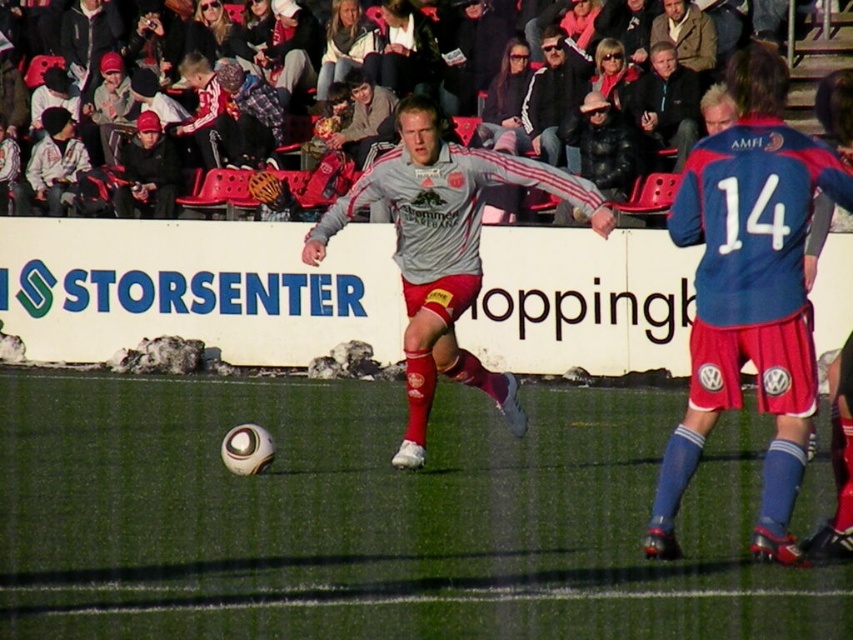
You are a soccer coach analyzing the play. The ball is at the center of the field. The matte gray jersey at center is 10.83 meters away from the blue jersey with red sleeves on the right. If the field is 100 meters long, what percentage of the field length does this distance represent?

The distance between the matte gray jersey at center and the blue jersey with red sleeves on the right is 10.83 meters. To find the percentage of the field length, divide 10.83 by 100 and multiply by 100, resulting in 10.83 percent. Thus, the distance represents approximately 10.83 percent of the field length.

You are a soccer coach analyzing the players on the field. You notice the blue jersey at right and the matte black jacket at left. Which player is taller in the image?

The blue jersey at right is taller than the matte black jacket at left.

Looking at this image, you are a soccer player who just kicked the ball. You notice the green artificial turf at center and the white cotton hoodie at upper left. Which object is smaller in size?

The green artificial turf at center has a smaller size compared to the white cotton hoodie at upper left, so the green artificial turf at center is smaller.